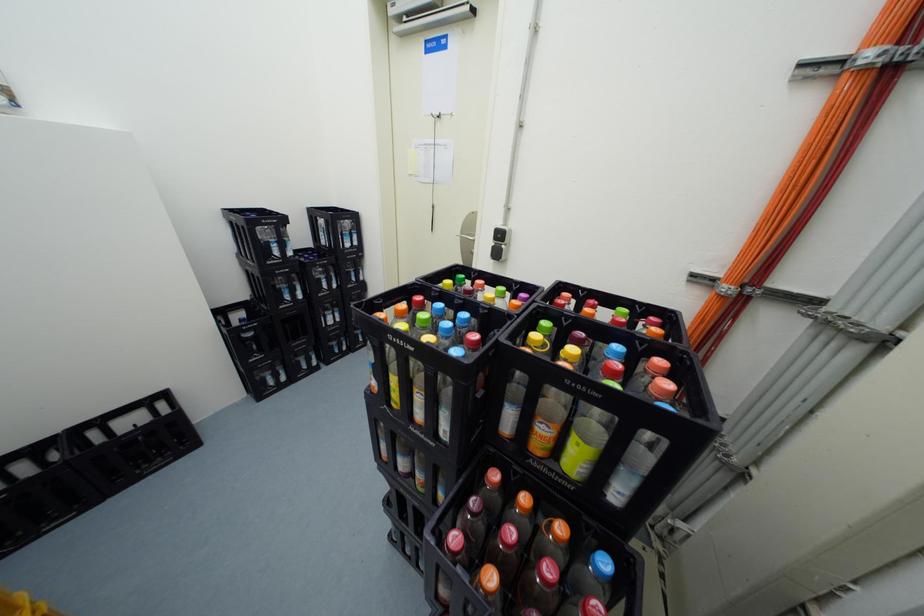
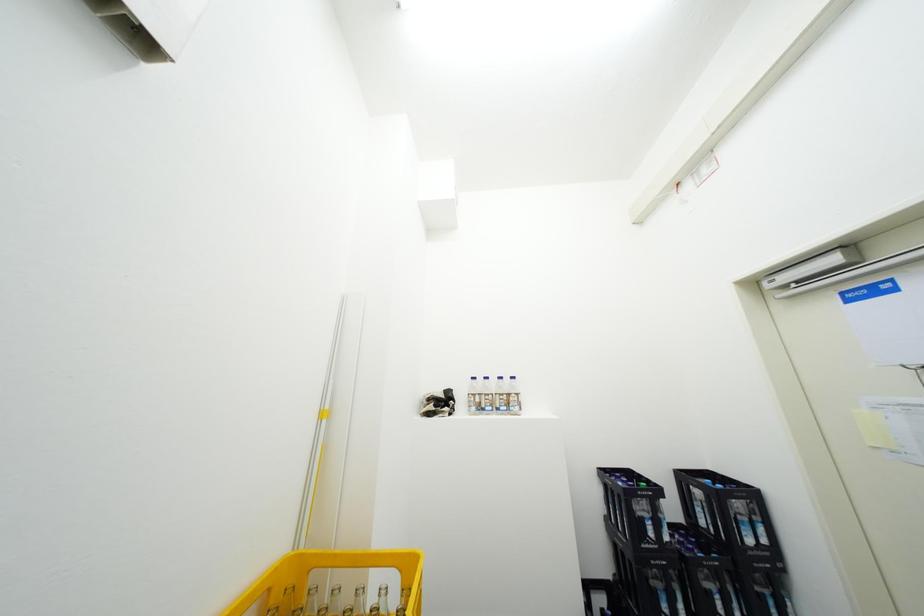
How did the camera likely rotate?

The camera rotated toward left-up.